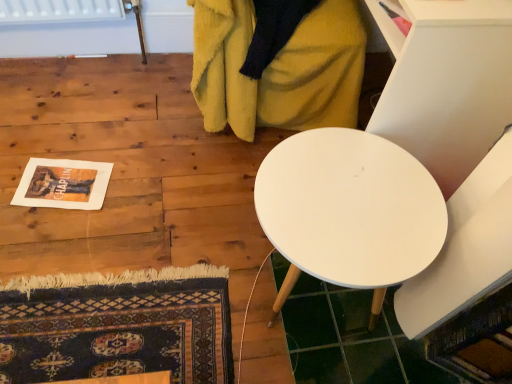
Question: Based on their positions, is white matte table at upper right located to the left or right of white matte table at center?

Choices:
 (A) left
 (B) right

Answer: (B)

Question: In the image, is white matte table at upper right positioned in front of or behind white matte table at center?

Choices:
 (A) front
 (B) behind

Answer: (B)

Question: Which is nearer to the white matte table at center?

Choices:
 (A) white matte table at upper right
 (B) soft yellow blanket at upper center

Answer: (A)

Question: Which object is positioned closest to the white matte table at upper right?

Choices:
 (A) white matte table at center
 (B) soft yellow blanket at upper center

Answer: (A)